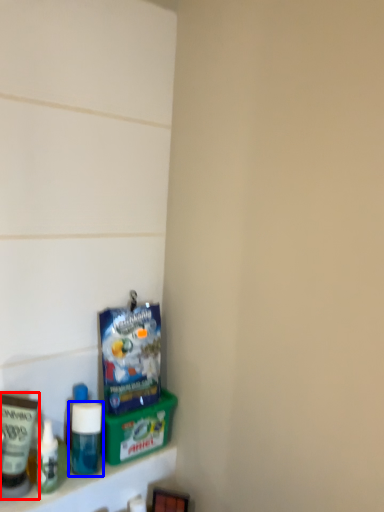
Question: Which of the following is the farthest to the observer, toiletry (highlighted by a red box) or bottle (highlighted by a blue box)?

Choices:
 (A) toiletry
 (B) bottle

Answer: (B)